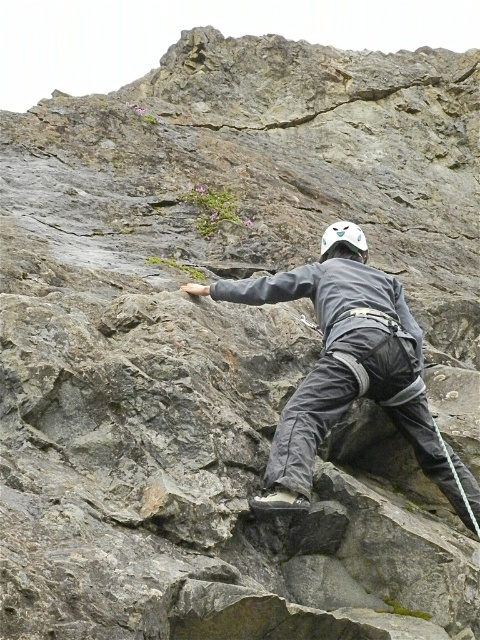
You are analyzing the rock climber in the image. There are two points marked on the rock face labeled as point (399, 340) and point (349, 244). Which point is positioned closer to you?

Point (399, 340) is closer to the viewer than point (349, 244).

You are a rock climber looking at your gear. You see a gray fabric helmet at center and a white matte helmet at center. Which helmet is positioned to the left?

The gray fabric helmet at center is positioned to the left of the white matte helmet at center.